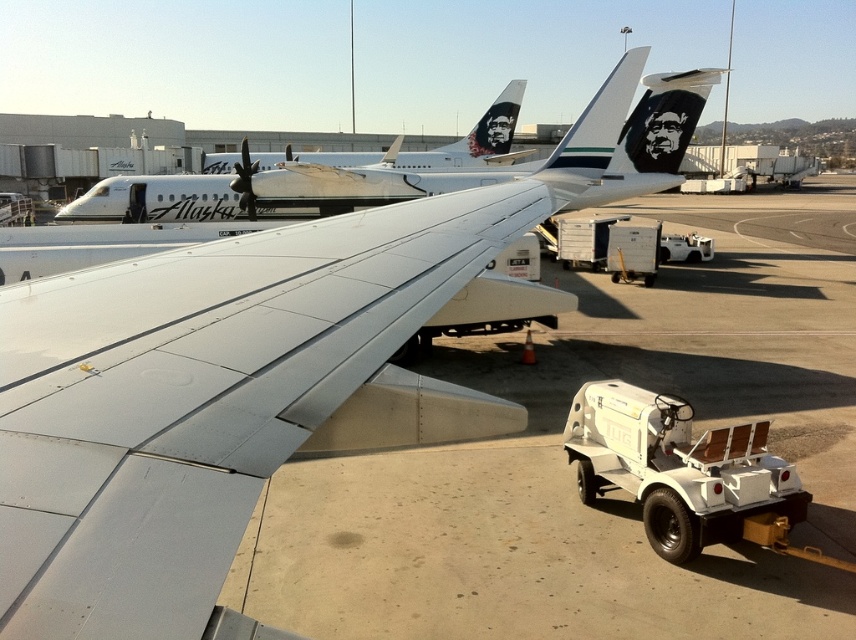
You are an airport maintenance worker and need to inspect the metallic gray wing at center and the white glossy airplane at upper center. Which object has a narrower width when viewed from above?

The metallic gray wing at center is thinner than the white glossy airplane at upper center, so the metallic gray wing at center has a narrower width when viewed from above.

You are an airport maintenance worker checking the tarmac conditions. You see the white glossy airplane at upper center and the white matte tarmac at center. Which surface is to the right of the other?

The white matte tarmac at center is to the right of the white glossy airplane at upper center.

You are an airport maintenance worker who needs to move a 10 meter long equipment cart from the terminal to the parking area. You have to pass through the space between the metallic gray wing at center and the white glossy airplane at upper left. Can the cart fit through the space between them?

The metallic gray wing at center is narrower than the white glossy airplane at upper left, so the 10 meter long equipment cart can fit through the space between them since the width of the metallic gray wing at center is less than the white glossy airplane at upper left.